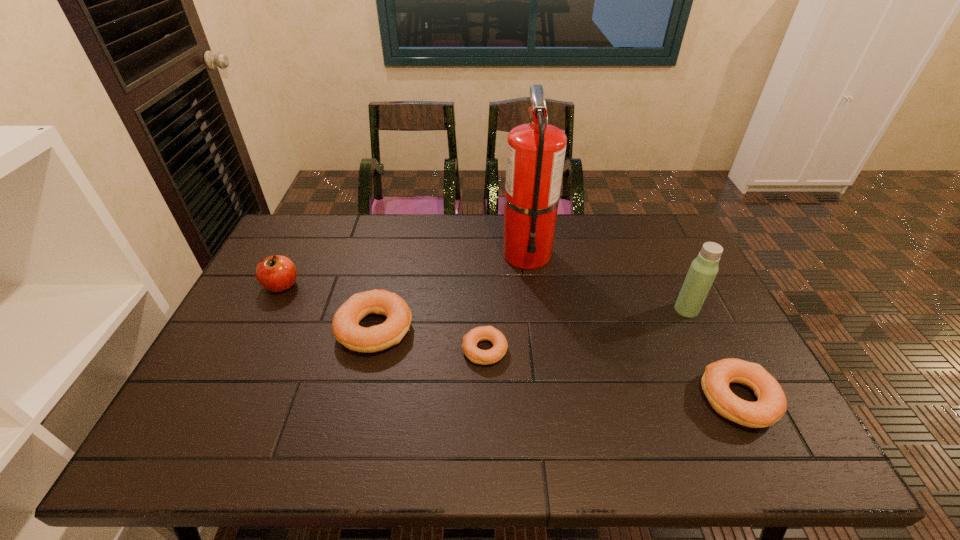
You are a GUI agent. You are given a task and a screenshot of the screen. Output one action in this format:
    pyautogui.click(x=<x>, y=<y>)
    Task: Click on the free region located on the back of the leftmost bagel
    This screenshot has width=960, height=540.
    Given the screenshot: What is the action you would take?
    [x=399, y=223]

At what (x,y) coordinates should I click in order to perform the action: click on vacant area situated on the front of the shortest object. Please return your answer as a coordinate pair (x, y). The image size is (960, 540). Looking at the image, I should click on (485, 403).

Locate an element on the screen. free space located 0.160m on the back of the second tallest bagel is located at coordinates (700, 321).

This screenshot has width=960, height=540. What are the coordinates of `vacant space located 0.270m at the nozzle of the tallest object` in the screenshot? It's located at (539, 344).

Where is `vacant space located on the front of the thermos bottle`? The image size is (960, 540). vacant space located on the front of the thermos bottle is located at coordinates (700, 337).

Locate an element on the screen. This screenshot has height=540, width=960. vacant area situated 0.150m on the back of the third tallest object is located at coordinates (301, 245).

Locate an element on the screen. object that is positioned at the far edge is located at coordinates (535, 151).

Image resolution: width=960 pixels, height=540 pixels. Identify the location of object at the near edge. (771, 405).

Where is `object present at the left edge`? The image size is (960, 540). object present at the left edge is located at coordinates (277, 273).

You are a GUI agent. You are given a task and a screenshot of the screen. Output one action in this format:
    pyautogui.click(x=<x>, y=<y>)
    Task: Click on the bagel present at the right edge
    
    Given the screenshot: What is the action you would take?
    pyautogui.click(x=771, y=405)